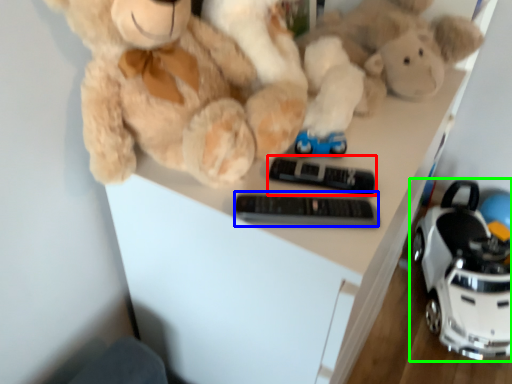
Question: Which object is the closest to the control (highlighted by a red box)? Choose among these: control (highlighted by a blue box) or land vehicle (highlighted by a green box).

Choices:
 (A) control
 (B) land vehicle

Answer: (A)